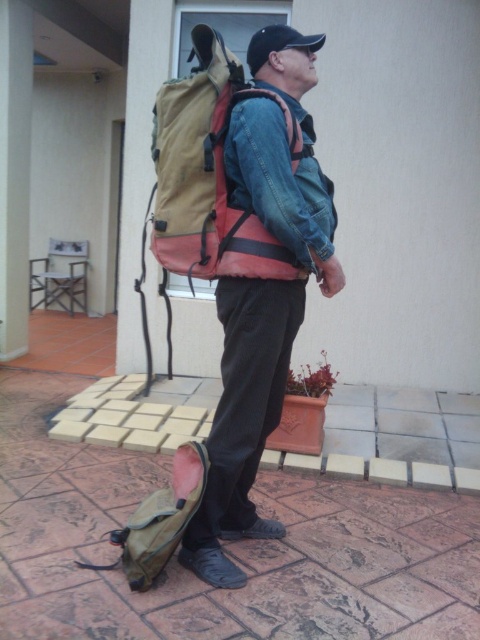
Question: Estimate the real-world distances between objects in this image. Which object is closer to the matte khaki backpack at lower left?

Choices:
 (A) leather at lower center
 (B) black leather shoe at lower center
 (C) denim jacket at center
 (D) matte khaki backpack at center

Answer: (B)

Question: Which point is farther to the camera?

Choices:
 (A) (232, 410)
 (B) (312, 244)
 (C) (236, 536)

Answer: (C)

Question: Which point is closer to the camera?

Choices:
 (A) (257, 397)
 (B) (305, 168)
 (C) (207, 552)

Answer: (B)

Question: Is matte khaki backpack at center thinner than denim jacket at center?

Choices:
 (A) no
 (B) yes

Answer: (A)

Question: Can you confirm if denim jacket at center is wider than leather at lower center?

Choices:
 (A) yes
 (B) no

Answer: (A)

Question: Is denim jacket at center bigger than black leather shoe at lower center?

Choices:
 (A) yes
 (B) no

Answer: (A)